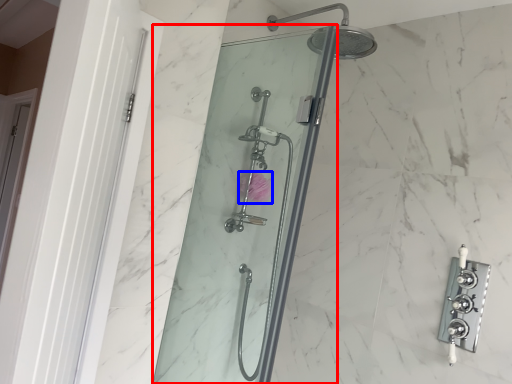
Question: Among these objects, which one is nearest to the camera, shower door (highlighted by a red box) or flower (highlighted by a blue box)?

Choices:
 (A) shower door
 (B) flower

Answer: (A)